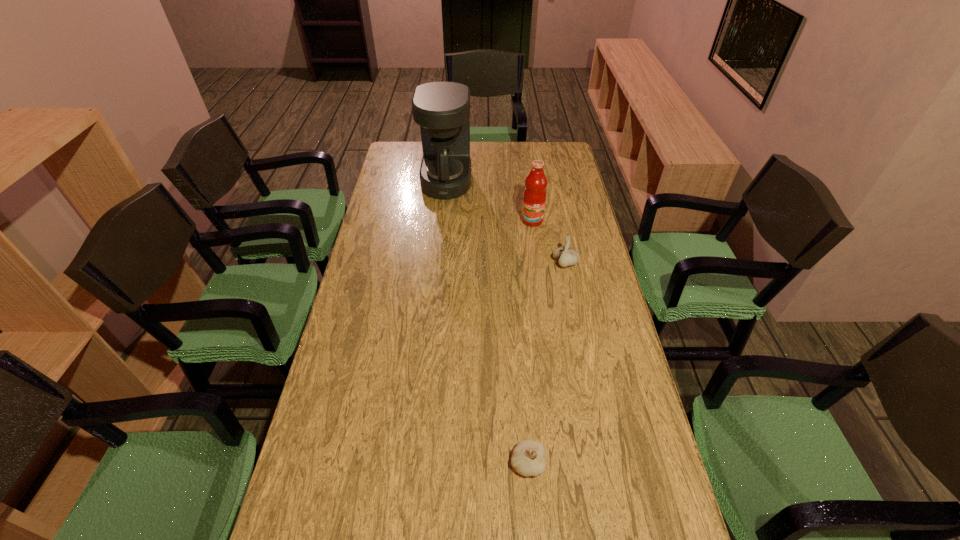
Image resolution: width=960 pixels, height=540 pixels. I want to click on coffee maker, so click(x=442, y=109).

The height and width of the screenshot is (540, 960). I want to click on the farthest object, so click(442, 109).

Image resolution: width=960 pixels, height=540 pixels. Find the location of `the second tallest object`. the second tallest object is located at coordinates (534, 197).

This screenshot has width=960, height=540. I want to click on the third nearest object, so click(534, 197).

I want to click on the farther garlic, so click(x=567, y=256).

I want to click on the third tallest object, so click(567, 256).

Where is `the third object from right to left`? the third object from right to left is located at coordinates (528, 458).

This screenshot has width=960, height=540. I want to click on the shortest object, so [528, 458].

Where is `vacant space located on the button side of the tallest object`? The height and width of the screenshot is (540, 960). vacant space located on the button side of the tallest object is located at coordinates (514, 182).

Identify the location of free space located on the front label of the third object from left to right. (541, 288).